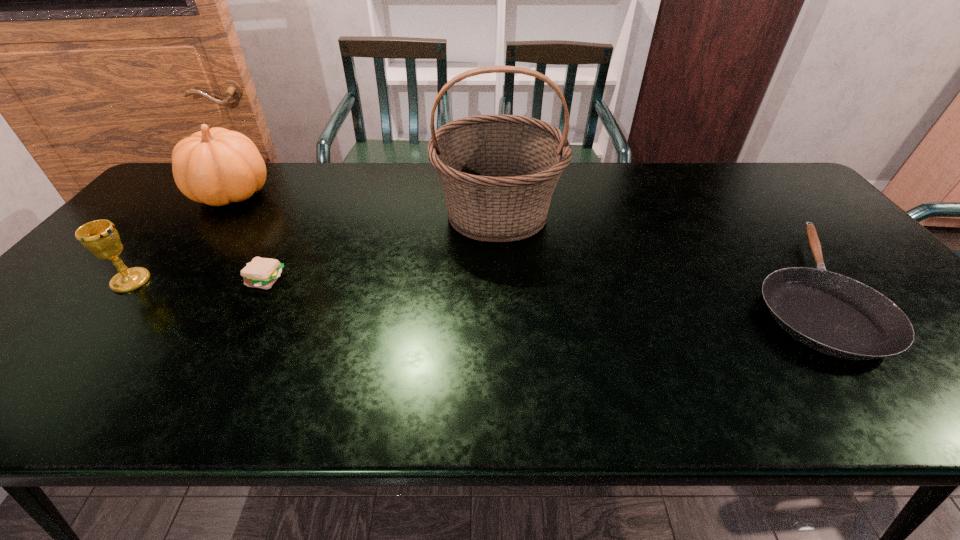
Find the location of a particular element. Image resolution: width=960 pixels, height=540 pixels. vacant space located 0.180m on the back of the rightmost object is located at coordinates (732, 198).

Identify the location of basket that is positioned at the far edge. Image resolution: width=960 pixels, height=540 pixels. [498, 172].

At what (x,y) coordinates should I click in order to perform the action: click on pumpkin at the far edge. Please return your answer as a coordinate pair (x, y). Image resolution: width=960 pixels, height=540 pixels. Looking at the image, I should click on (216, 166).

Locate an element on the screen. The width and height of the screenshot is (960, 540). pumpkin at the left edge is located at coordinates (216, 166).

Find the location of `chalice located in the left edge section of the desktop`. chalice located in the left edge section of the desktop is located at coordinates (100, 237).

What are the coordinates of `object positioned at the right edge` in the screenshot? It's located at (836, 315).

This screenshot has width=960, height=540. I want to click on object positioned at the far left corner, so click(x=216, y=166).

In the image, there is a desktop. At what (x,y) coordinates should I click in order to perform the action: click on free region at the far edge. Please return your answer as a coordinate pair (x, y). The height and width of the screenshot is (540, 960). Looking at the image, I should click on (678, 199).

Where is `vacant space at the near edge of the desktop`? vacant space at the near edge of the desktop is located at coordinates (846, 400).

Where is `free space at the left edge`? free space at the left edge is located at coordinates (145, 264).